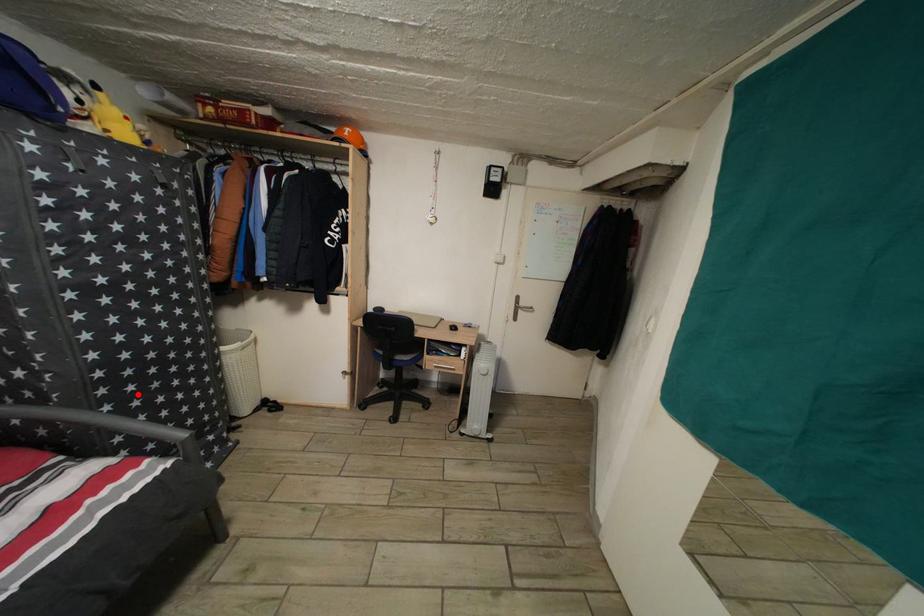
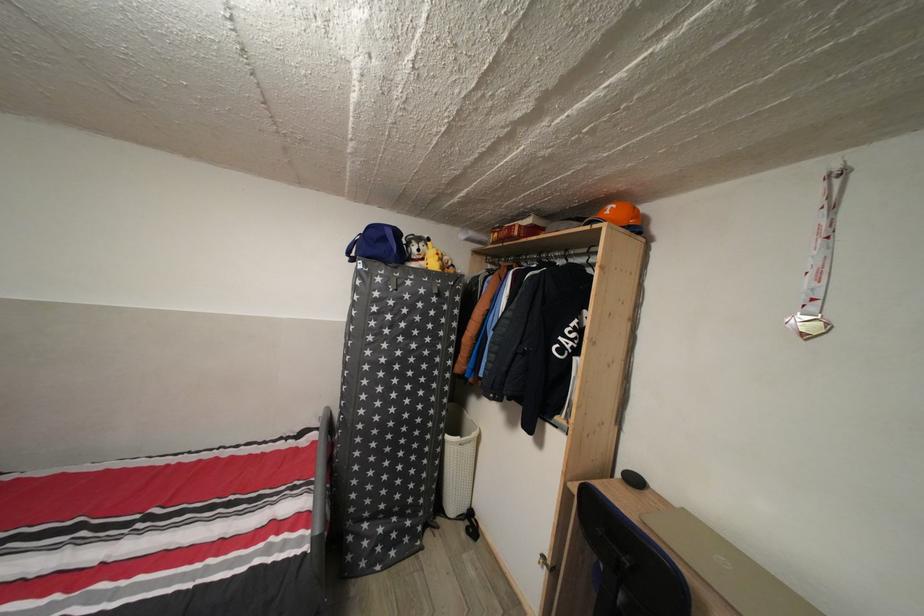
Question: I am providing you with two images of the same scene from different viewpoints. In image1, a red point is highlighted. Considering the same 3D point in image2, which of the following is correct?

Choices:
 (A) It is closer
 (B) It is farther

Answer: (B)